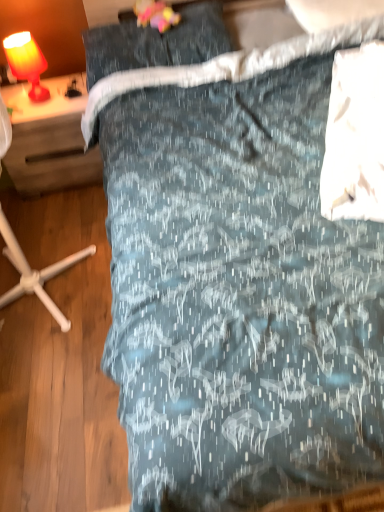
Where is `vacant space underneath matte orange lamp at upper left (from a real-world perspective)`? The width and height of the screenshot is (384, 512). vacant space underneath matte orange lamp at upper left (from a real-world perspective) is located at coordinates coord(49,102).